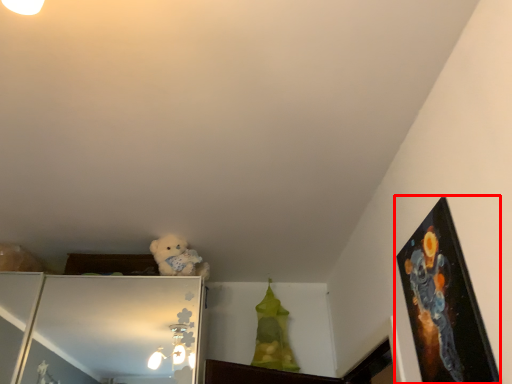
Question: Where is picture frame (annotated by the red box) located in relation to animal in the image?

Choices:
 (A) right
 (B) left

Answer: (A)